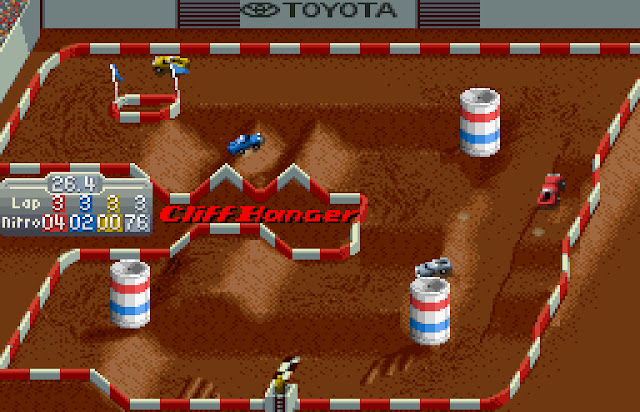
Where is `ladder`? The width and height of the screenshot is (640, 412). ladder is located at coordinates (276, 401).